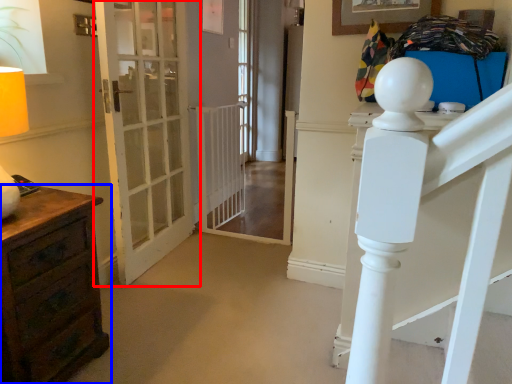
Question: Which point is further to the camera, door (highlighted by a red box) or chest of drawers (highlighted by a blue box)?

Choices:
 (A) door
 (B) chest of drawers

Answer: (A)